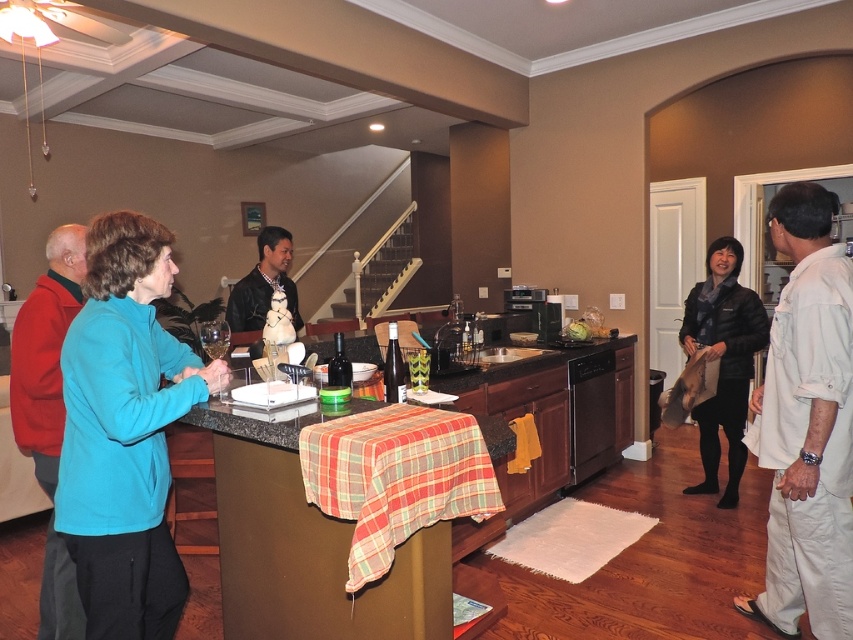
You are a chef who needs to move from the teal fleece jacket at left to the leather jacket at center. Considering your height is 1.8 meters, will you be able to comfortably walk between them without bending down?

The distance between the teal fleece jacket at left and the leather jacket at center is 1.24 meters. Since the space is only 1.24 meters wide, a chef who is 1.8 meters tall would need to bend down to pass through this narrow space. Therefore, it might not be comfortable to walk between them without bending.

You are standing at the kitchen island and want to place a new item on the counter. There are two points marked on the counter where you can place it. The first point is at coordinate point (640, 332) and the second is at point (242, 310). According to the image, which point is closer to you?

Point (242, 310) is closer to you because point (640, 332) is behind it.

You are a server carrying a tray of drinks and need to place them on the granite countertop at center. You are currently standing next to the black leather jacket at right. Is there enough space between you and the countertop to safely maneuver your tray?

The distance between the black leather jacket at right and the granite countertop at center is 76.68 centimeters. This should provide sufficient space for a server to safely maneuver a tray of drinks, as typical tray widths are much narrower than this distance.